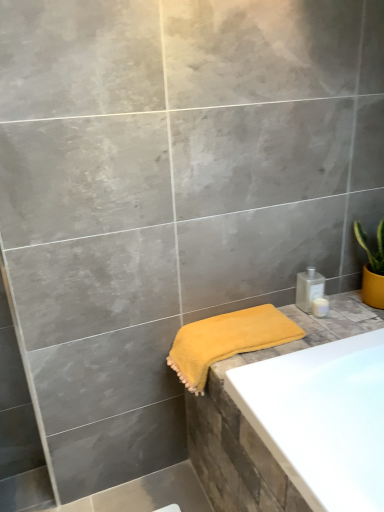
I want to click on empty space that is to the right of satin silver bottle at right, the 2th toiletry when ordered from bottom to top, so click(349, 308).